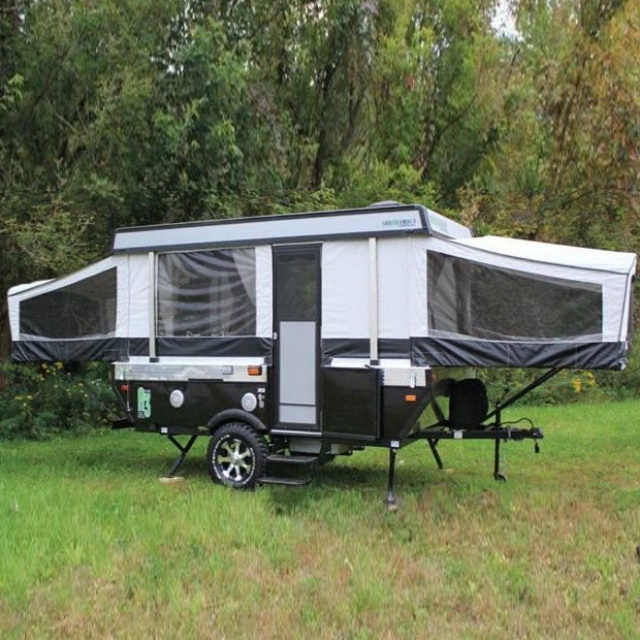
Can you confirm if green grass at center is thinner than black metallic wheel at lower center?

Yes, green grass at center is thinner than black metallic wheel at lower center.

Is point (376, 515) closer to camera compared to point (216, 445)?

Yes.

Where is `green grass at center`? green grass at center is located at coordinates (326, 541).

Does green grass at center appear on the right side of black matte pop-up camper at center?

Indeed, green grass at center is positioned on the right side of black matte pop-up camper at center.

Does green grass at center have a larger size compared to black matte pop-up camper at center?

No, green grass at center is not bigger than black matte pop-up camper at center.

This screenshot has height=640, width=640. I want to click on green grass at center, so click(326, 541).

Is black matte pop-up camper at center to the left of black metallic wheel at lower center from the viewer's perspective?

Yes, black matte pop-up camper at center is to the left of black metallic wheel at lower center.

Measure the distance between black matte pop-up camper at center and camera.

A distance of 7.82 meters exists between black matte pop-up camper at center and camera.

The image size is (640, 640). Find the location of `black matte pop-up camper at center`. black matte pop-up camper at center is located at coordinates (326, 324).